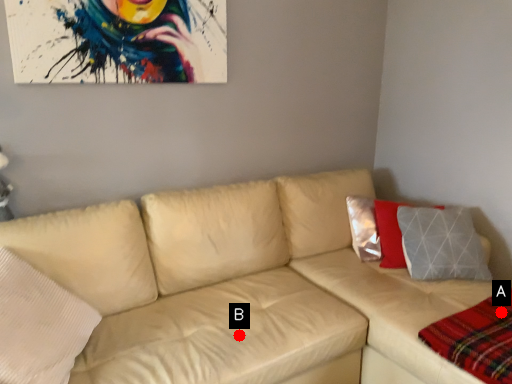
Question: Two points are circled on the image, labeled by A and B beside each circle. Among these points, which one is nearest to the camera?

Choices:
 (A) A is closer
 (B) B is closer

Answer: (B)